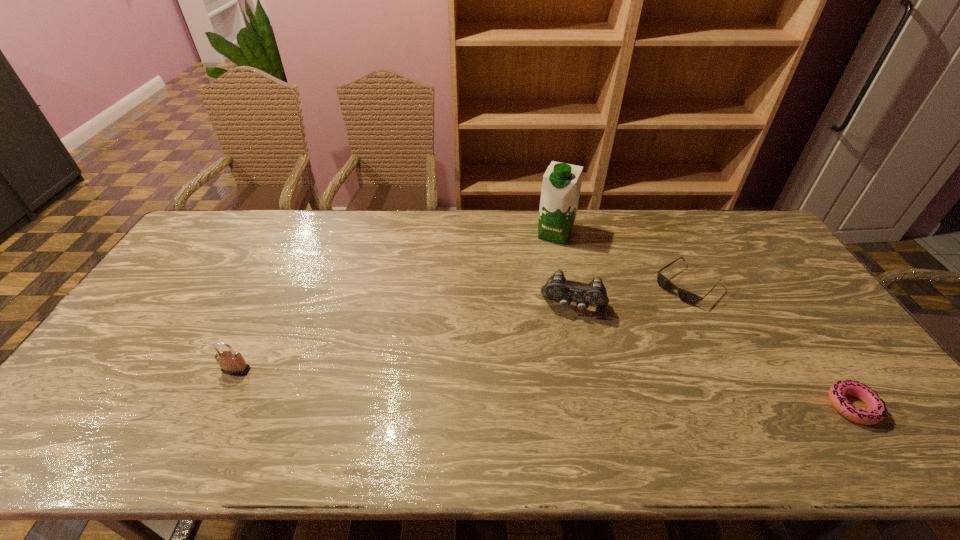
Find the location of a particular element. Image resolution: width=960 pixels, height=540 pixels. empty space between the fourth farthest object and the control is located at coordinates [x=405, y=338].

I want to click on vacant space that is in between the control and the leftmost object, so click(x=405, y=338).

At what (x,y) coordinates should I click in order to perform the action: click on free area in between the leftmost object and the rightmost object. Please return your answer as a coordinate pair (x, y). Looking at the image, I should click on (544, 388).

Find the location of a particular element. The width and height of the screenshot is (960, 540). free space between the tallest object and the rightmost object is located at coordinates (704, 320).

At what (x,y) coordinates should I click in order to perform the action: click on unoccupied position between the leftmost object and the rightmost object. Please return your answer as a coordinate pair (x, y). Looking at the image, I should click on (544, 388).

Where is `free space between the soya milk and the rightmost object`? This screenshot has width=960, height=540. free space between the soya milk and the rightmost object is located at coordinates (704, 320).

Where is `free space between the doughnut and the control`? free space between the doughnut and the control is located at coordinates (713, 356).

Choose which object is the fourth nearest neighbor to the rightmost object. Please provide its 2D coordinates. Your answer should be formatted as a tuple, i.e. [(x, y)], where the tuple contains the x and y coordinates of a point satisfying the conditions above.

[(232, 363)]

This screenshot has width=960, height=540. What are the coordinates of `object that stands as the closest to the control` in the screenshot? It's located at (687, 297).

You are a GUI agent. You are given a task and a screenshot of the screen. Output one action in this format:
    pyautogui.click(x=<x>, y=<y>)
    Task: Click on the vacant region that satisfies the following two spatial constraints: 1. on the front side of the rightmost object; 2. on the left side of the padlock
    This screenshot has height=540, width=960.
    Given the screenshot: What is the action you would take?
    pyautogui.click(x=219, y=406)